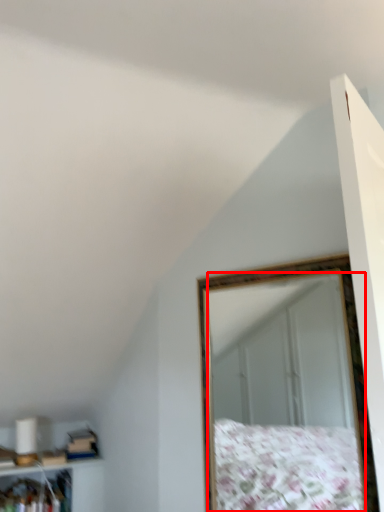
Question: From the image's perspective, where is mirror (annotated by the red box) located relative to cabinet?

Choices:
 (A) above
 (B) below

Answer: (A)